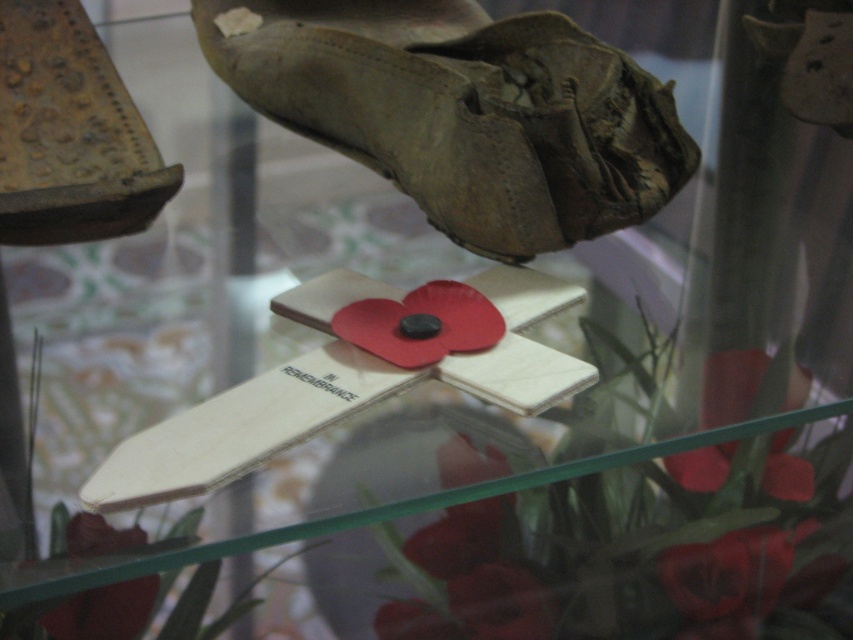
Question: Is wooden cross at center to the left of matte red poppy at lower center from the viewer's perspective?

Choices:
 (A) yes
 (B) no

Answer: (B)

Question: Is leather shoe at upper center thinner than matte paper poppy at center?

Choices:
 (A) yes
 (B) no

Answer: (B)

Question: Which object is positioned closest to the leather shoe at upper center?

Choices:
 (A) wooden cross at center
 (B) matte red poppy at lower center

Answer: (A)

Question: Can you confirm if leather shoe at upper center is positioned to the left of matte red poppy at lower center?

Choices:
 (A) yes
 (B) no

Answer: (B)

Question: Which object appears closest to the camera in this image?

Choices:
 (A) matte paper poppy at center
 (B) rusty metal shoe at upper left
 (C) wooden cross at center

Answer: (C)

Question: Which point is farther to the camera?

Choices:
 (A) leather shoe at upper center
 (B) wooden cross at center
 (C) matte paper poppy at center

Answer: (C)